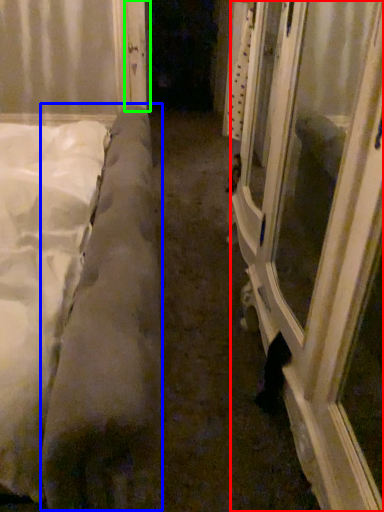
Question: Based on their relative distances, which object is farther from window frame (highlighted by a red box)? Choose from mattress (highlighted by a blue box) and door (highlighted by a green box).

Choices:
 (A) mattress
 (B) door

Answer: (B)